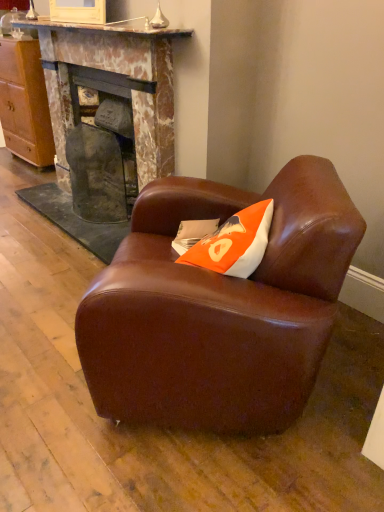
Question: Based on their positions, is brown leather armchair at center located to the left or right of wooden cabinet at left?

Choices:
 (A) right
 (B) left

Answer: (A)

Question: Is point (134, 208) positioned closer to the camera than point (44, 138)?

Choices:
 (A) closer
 (B) farther

Answer: (A)

Question: Which is farther from the brown leather armchair at center?

Choices:
 (A) marble fireplace at center, the second fireplace positioned from the left
 (B) rustic stone fireplace at center, arranged as the second fireplace when viewed from the right
 (C) orange fabric pillow at center
 (D) wooden cabinet at left

Answer: (D)

Question: Which object is positioned farthest from the rustic stone fireplace at center, positioned as the first fireplace in left-to-right order?

Choices:
 (A) wooden cabinet at left
 (B) marble fireplace at center, the second fireplace positioned from the left
 (C) orange fabric pillow at center
 (D) brown leather armchair at center

Answer: (D)